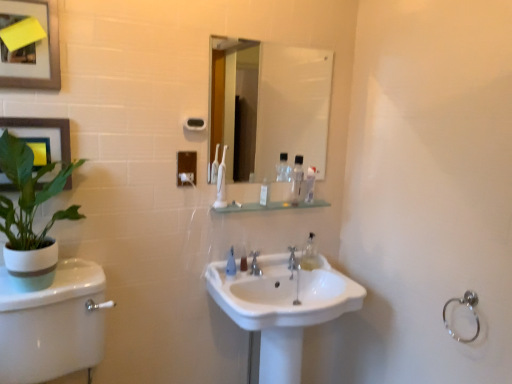
Question: From their relative heights in the image, would you say clear plastic bottle at upper center, which appears as the 3th mouthwash when ordered from the bottom, is taller or shorter than silver metallic faucet at center?

Choices:
 (A) tall
 (B) short

Answer: (A)

Question: From a real-world perspective, is clear plastic bottle at upper center, which is the 1th mouthwash from top to bottom, physically located above or below silver metallic faucet at center?

Choices:
 (A) above
 (B) below

Answer: (A)

Question: Based on their relative distances, which object is farther from the matte black picture frame at upper left, the 1th picture frame when ordered from bottom to top?

Choices:
 (A) transparent glass shelf at center
 (B) clear plastic bottle at center, positioned as the 1th mouthwash in left-to-right order
 (C) satin nickel faucet at center
 (D) clear plastic bottle at upper center, placed as the 2th mouthwash when sorted from bottom to top
 (E) white ceramic sink at center

Answer: (C)

Question: Which of these objects is positioned closest to the white plastic tube at center?

Choices:
 (A) transparent glass shelf at center
 (B) satin nickel faucet at center
 (C) white ceramic sink at center
 (D) clear plastic bottle at center, the first mouthwash in the bottom-to-top sequence
 (E) clear plastic bottle at upper center, placed as the 2th mouthwash when sorted from bottom to top

Answer: (A)